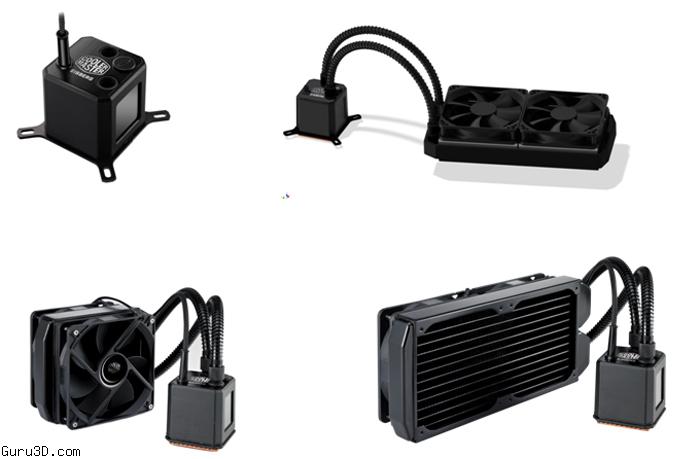
Find the location of a particular element. The image size is (700, 459). vent is located at coordinates (466, 384).